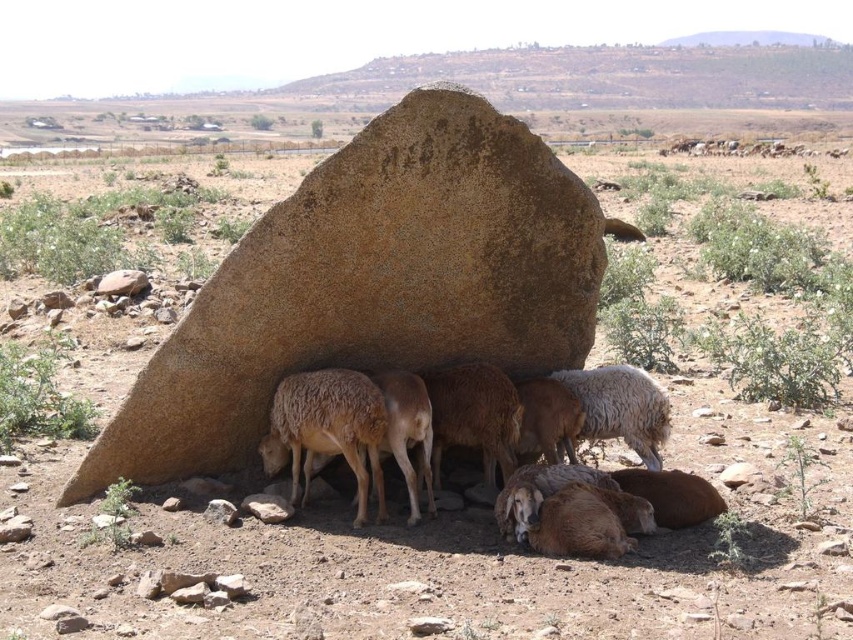
Does brown rough rock at center have a greater width compared to white woolly sheep at center?

Yes, brown rough rock at center is wider than white woolly sheep at center.

Can you confirm if brown rough rock at center is smaller than white woolly sheep at center?

No.

Where is `brown rough rock at center`? Image resolution: width=853 pixels, height=640 pixels. brown rough rock at center is located at coordinates (370, 284).

You are a GUI agent. You are given a task and a screenshot of the screen. Output one action in this format:
    pyautogui.click(x=<x>, y=<y>)
    Task: Click on the brown rough rock at center
    
    Given the screenshot: What is the action you would take?
    pyautogui.click(x=370, y=284)

Which of these two, brown rough rock at center or fuzzy woolen sheep under rock, stands taller?

brown rough rock at center is taller.

Is brown rough rock at center shorter than fuzzy woolen sheep under rock?

Incorrect, brown rough rock at center's height does not fall short of fuzzy woolen sheep under rock's.

Is point (416, 93) positioned in front of point (363, 458)?

Yes.

I want to click on brown rough rock at center, so click(370, 284).

Does point (326, 433) lie behind point (622, 374)?

No, it is in front of (622, 374).

Measure the distance from fuzzy woolen sheep under rock to white woolly sheep at center.

The distance of fuzzy woolen sheep under rock from white woolly sheep at center is 3.91 feet.

This screenshot has height=640, width=853. What do you see at coordinates (332, 426) in the screenshot?
I see `fuzzy woolen sheep under rock` at bounding box center [332, 426].

Find the location of `fuzzy woolen sheep under rock`. fuzzy woolen sheep under rock is located at coordinates (332, 426).